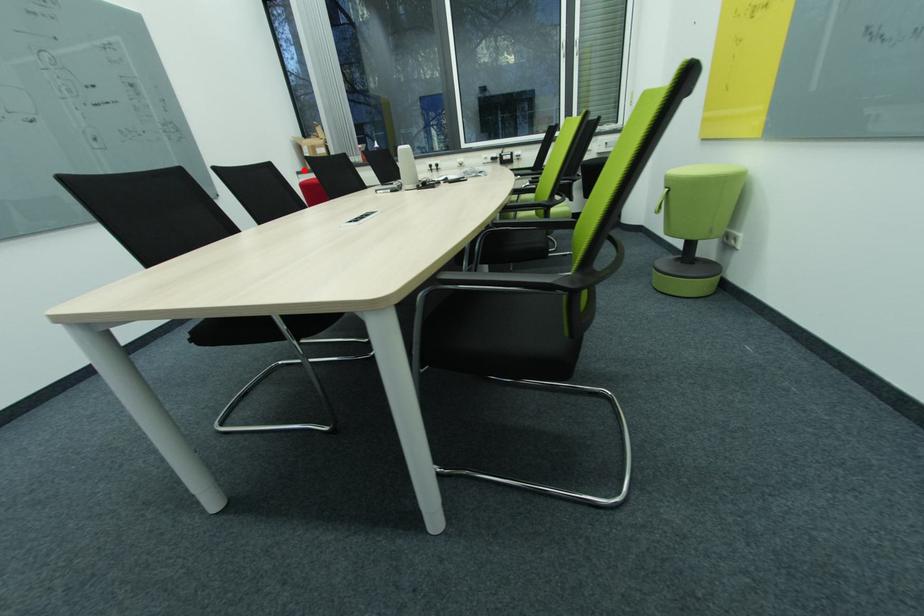
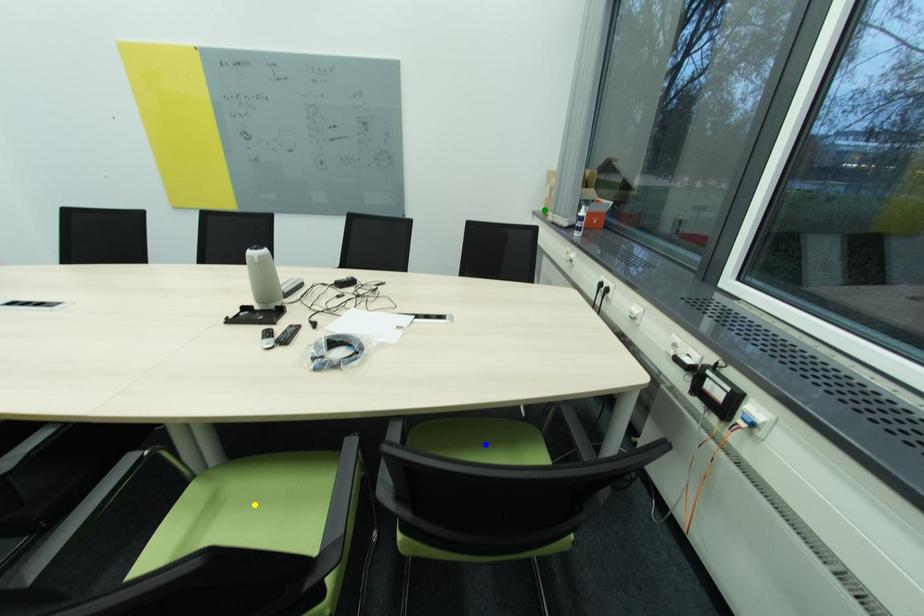
Question: I am providing you with two images of the same scene from different viewpoints. A red point is marked on the first image. You are given multiple points on the second image. Which point in image 2 represents the same 3d spot as the red point in image 1?

Choices:
 (A) green point
 (B) blue point
 (C) yellow point

Answer: (A)